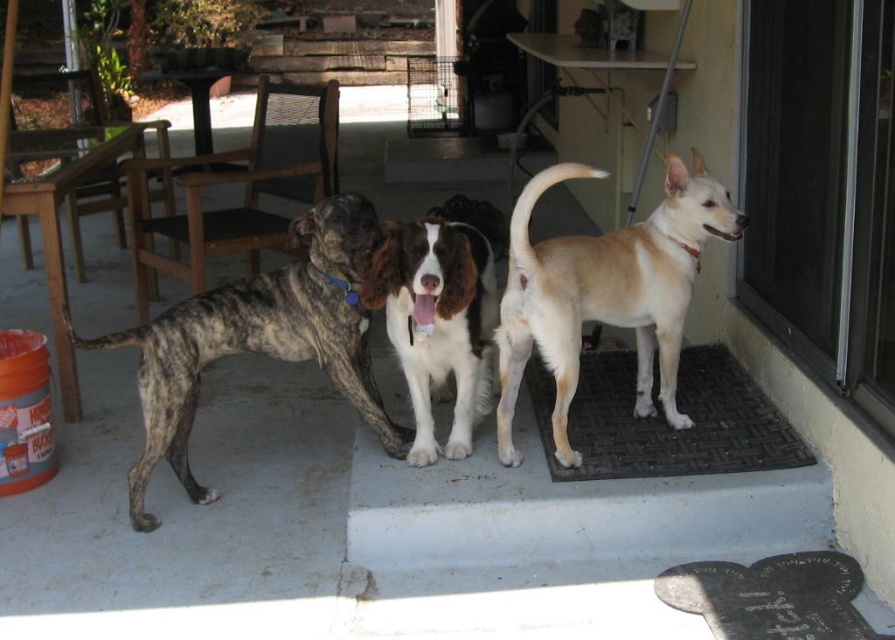
From the picture: Can you confirm if transparent glass door at upper right is taller than white glossy dog at center?

Correct, transparent glass door at upper right is much taller as white glossy dog at center.

Who is lower down, transparent glass door at upper right or white glossy dog at center?

Positioned lower is white glossy dog at center.

Between point (765, 112) and point (419, 307), which one is positioned behind?

Positioned behind is point (765, 112).

Identify the location of transparent glass door at upper right. This screenshot has width=895, height=640. (823, 189).

Does transparent glass door at upper right have a greater width compared to light brown fur at center?

Incorrect, transparent glass door at upper right's width does not surpass light brown fur at center's.

Does transparent glass door at upper right appear on the left side of light brown fur at center?

Incorrect, transparent glass door at upper right is not on the left side of light brown fur at center.

This screenshot has height=640, width=895. Describe the element at coordinates (823, 189) in the screenshot. I see `transparent glass door at upper right` at that location.

I want to click on transparent glass door at upper right, so click(823, 189).

Based on the photo, can you confirm if light brown fur at center is positioned to the right of black rubber doormat at lower right?

No, light brown fur at center is not to the right of black rubber doormat at lower right.

In the scene shown: Can you confirm if light brown fur at center is smaller than black rubber doormat at lower right?

No, light brown fur at center is not smaller than black rubber doormat at lower right.

This screenshot has height=640, width=895. I want to click on light brown fur at center, so click(604, 292).